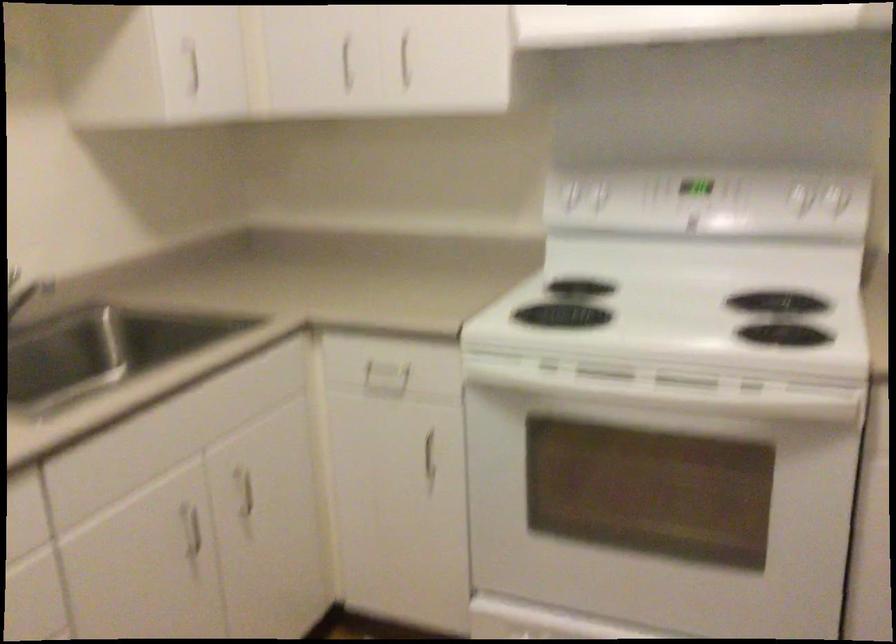
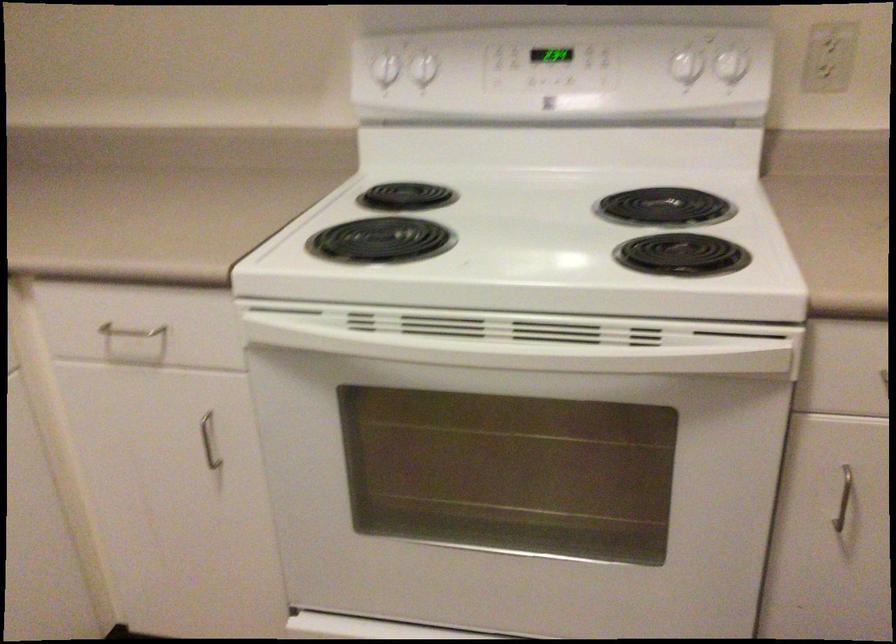
Find the pixel in the second image that matches pixel 564 314 in the first image.

(380, 240)